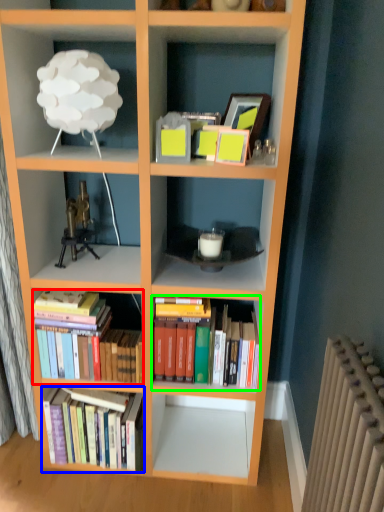
Question: Which object is positioned closest to book (highlighted by a red box)? Select from book (highlighted by a blue box) and book (highlighted by a green box).

Choices:
 (A) book
 (B) book

Answer: (A)